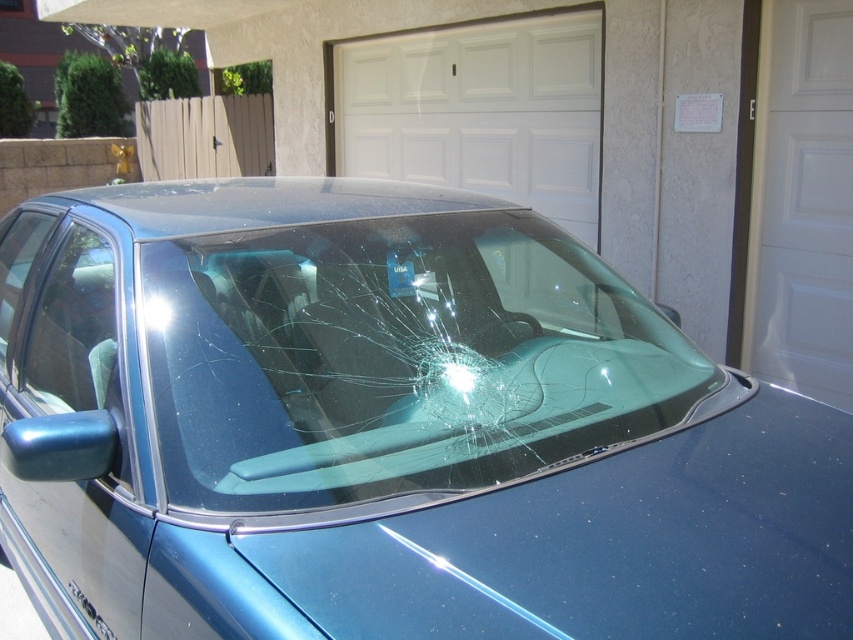
Question: Is glossy blue car at center wider than transparent glass window at center?

Choices:
 (A) yes
 (B) no

Answer: (A)

Question: Observing the image, what is the correct spatial positioning of white smooth door at right in reference to transparent glass window at center?

Choices:
 (A) right
 (B) left

Answer: (A)

Question: Which object is farther from the camera taking this photo?

Choices:
 (A) transparent glass window at center
 (B) glossy blue car at center
 (C) white smooth garage door at center

Answer: (C)

Question: Which point appears farthest from the camera in this image?

Choices:
 (A) (325, 241)
 (B) (807, 400)
 (C) (840, 132)

Answer: (C)

Question: Does glossy blue car at center lie in front of transparent glass window at center?

Choices:
 (A) yes
 (B) no

Answer: (A)

Question: Considering the real-world distances, which object is farthest from the white smooth garage door at center?

Choices:
 (A) white smooth door at right
 (B) transparent glass window at center

Answer: (B)